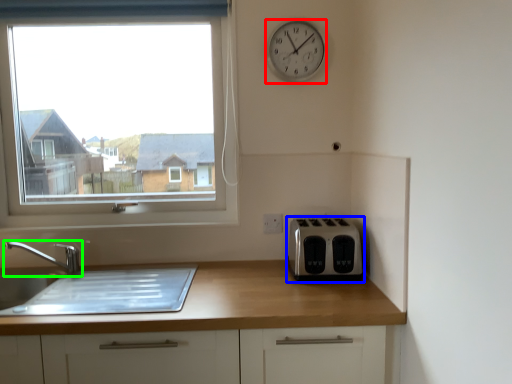
Question: Based on their relative distances, which object is farther from clock (highlighted by a red box)? Choose from toaster (highlighted by a blue box) and tap (highlighted by a green box).

Choices:
 (A) toaster
 (B) tap

Answer: (B)